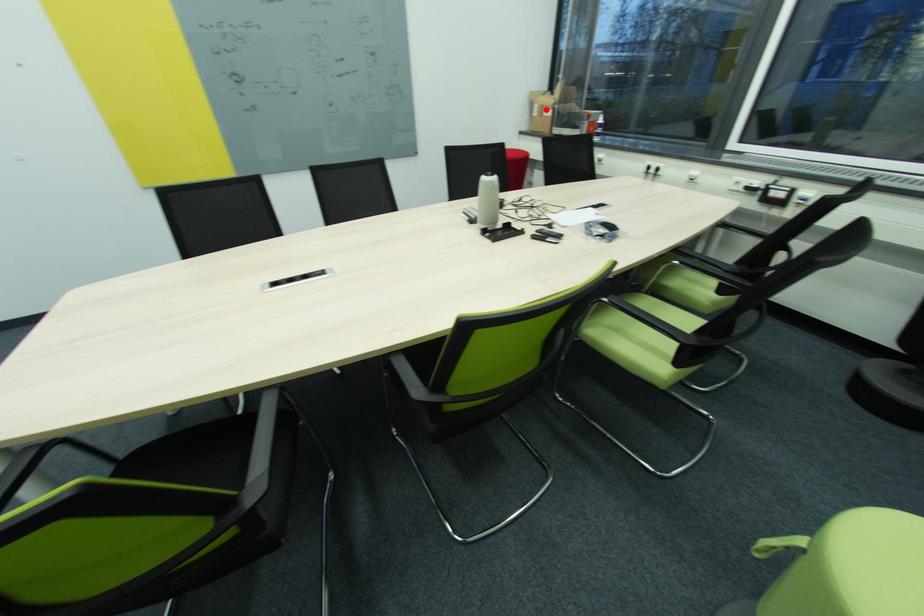
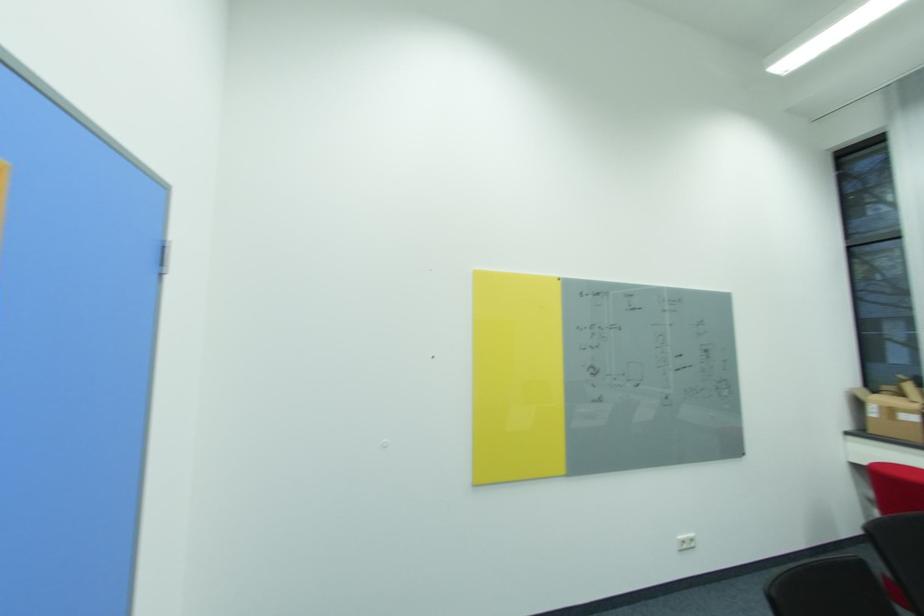
Question: I am providing you with two images of the same scene from different viewpoints. A red point is shown in image1. For the corresponding object point in image2, is it positioned nearer or farther from the camera?

Choices:
 (A) Nearer
 (B) Farther

Answer: (B)